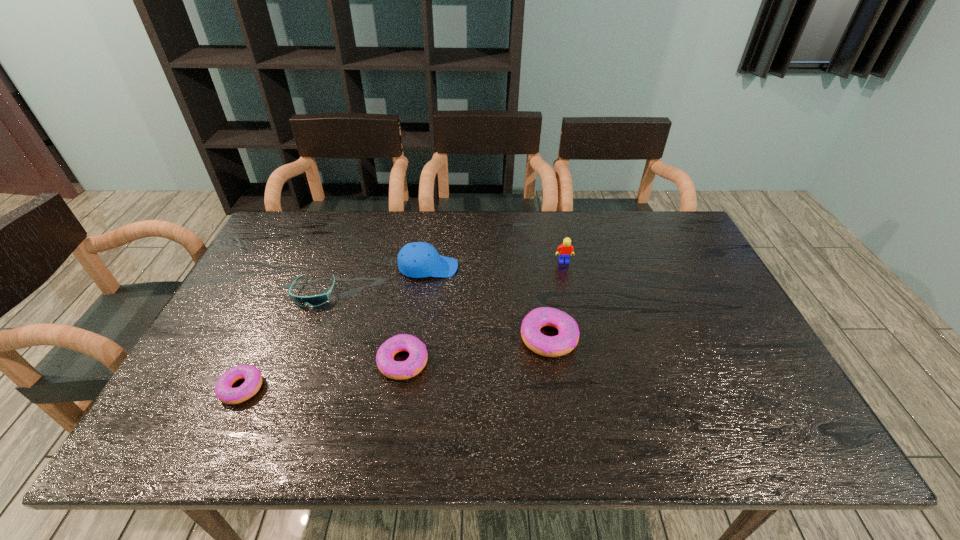
What are the coordinates of `vacant region located 0.330m on the left of the fourth shortest object` in the screenshot? It's located at (393, 338).

Where is `vacant space located on the front-facing side of the Lego`? Image resolution: width=960 pixels, height=540 pixels. vacant space located on the front-facing side of the Lego is located at coordinates (568, 284).

This screenshot has height=540, width=960. Identify the location of vacant space situated on the front-facing side of the sunglasses. (270, 404).

At what (x,y) coordinates should I click in order to perform the action: click on free space located on the front-facing side of the cap. Please return your answer as a coordinate pair (x, y). Looking at the image, I should click on (484, 267).

You are a GUI agent. You are given a task and a screenshot of the screen. Output one action in this format:
    pyautogui.click(x=<x>, y=<y>)
    Task: Click on the object that is at the left edge
    
    Given the screenshot: What is the action you would take?
    pyautogui.click(x=225, y=393)

The width and height of the screenshot is (960, 540). I want to click on object that is at the near left corner, so click(225, 393).

Locate an element on the screen. free spot at the far edge of the desktop is located at coordinates (624, 222).

The height and width of the screenshot is (540, 960). In order to click on vacant region at the near edge of the desktop in this screenshot , I will do `click(373, 394)`.

Image resolution: width=960 pixels, height=540 pixels. I want to click on free region at the left edge, so click(x=285, y=307).

Where is `vacant area at the right edge`? Image resolution: width=960 pixels, height=540 pixels. vacant area at the right edge is located at coordinates (710, 331).